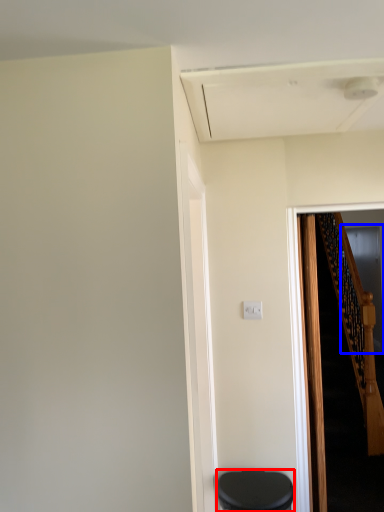
Question: Among these objects, which one is nearest to the camera, furniture (highlighted by a red box) or glass door (highlighted by a blue box)?

Choices:
 (A) furniture
 (B) glass door

Answer: (A)